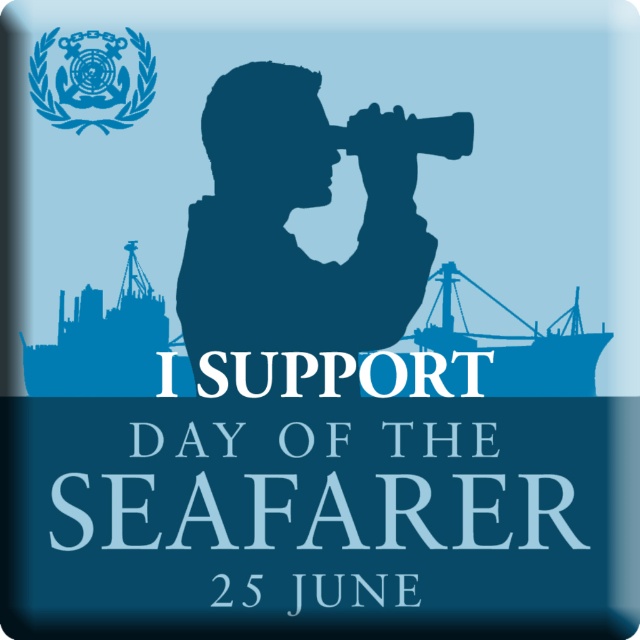
In the scene shown: You are designing a poster for the Day of the Seafarer. You need to ensure that the blue matte ship at center is placed below the blue glossy emblem at upper left. Based on the provided image description, does the current arrangement meet this requirement?

Yes, the blue matte ship at center is positioned under the blue glossy emblem at upper left, so the current arrangement meets the requirement.

From the picture: You are standing in front of the promotional graphic for the Day of the Seafarer. There are two points marked on the image. The first point is at coordinates point (96, 376) and the second point is at point (120, 388). Which point is closer to you?

Point (96, 376) is in front of point (120, 388), so it is closer to you.